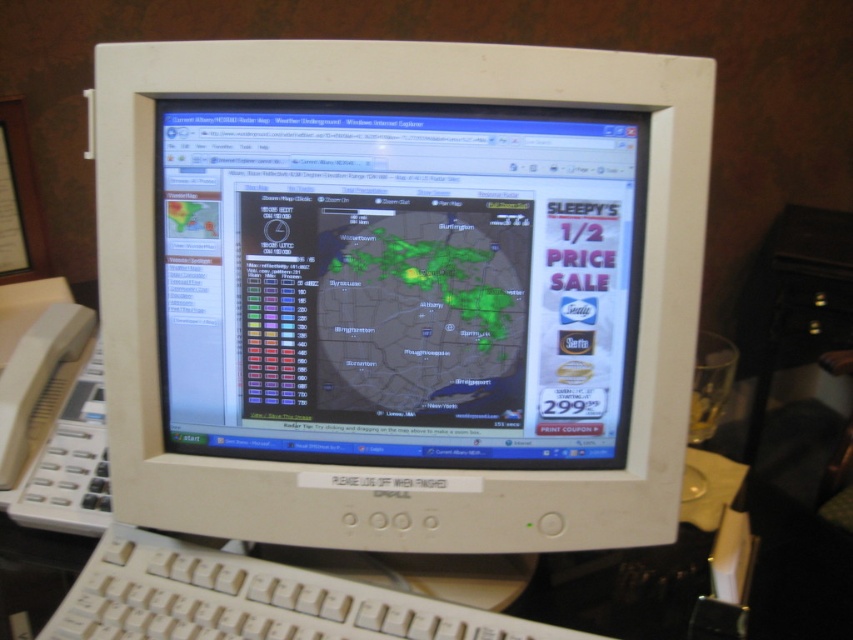
You are setting up a desk and need to place the white plastic monitor at center and the white plastic keyboard at lower center. Given that the desk has limited space, which object should you place first to ensure both fit properly?

The white plastic monitor at center is larger in size than the white plastic keyboard at lower center, so you should place the white plastic monitor at center first to accommodate its larger size and ensure both fit properly.

You are a technician who needs to adjust the focus of the white plastic monitor at center. The focus knob is located 50 centimeters away from the monitor. Can you reach it without moving your position?

The white plastic monitor at center is 48.44 centimeters away from the camera, so the technician can reach the focus knob located 50 centimeters away from the monitor since the distance is slightly more than the monitor to camera distance.